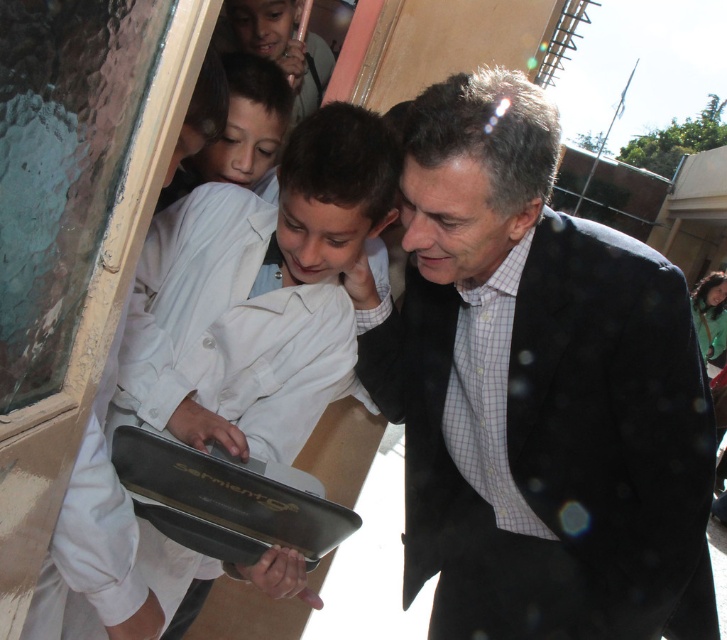
Who is shorter, dark blue suit at center or white matte laptop at center?

With less height is white matte laptop at center.

Identify the location of dark blue suit at center. This screenshot has height=640, width=727. (537, 390).